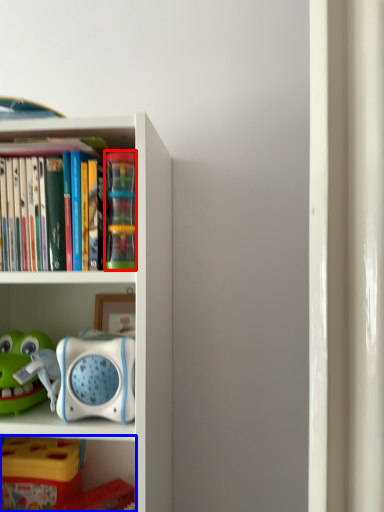
Question: Which object is further to the camera taking this photo, toy (highlighted by a red box) or shelf (highlighted by a blue box)?

Choices:
 (A) toy
 (B) shelf

Answer: (B)